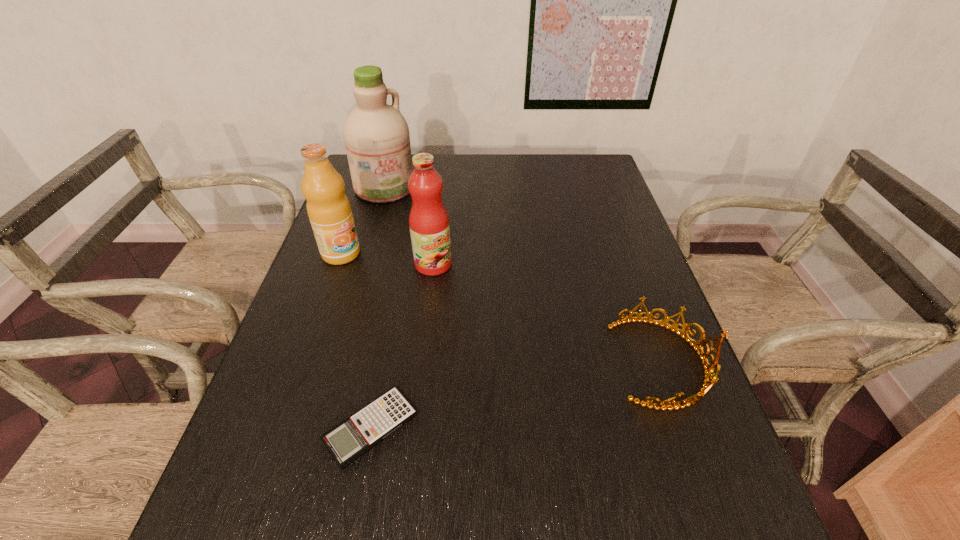
Where is `fruit juice that is at the left edge`? The height and width of the screenshot is (540, 960). fruit juice that is at the left edge is located at coordinates (329, 211).

This screenshot has width=960, height=540. In order to click on cleansing agent located at the left edge in this screenshot , I will do `click(376, 135)`.

At what (x,y) coordinates should I click in order to perform the action: click on object that is at the right edge. Please return your answer as a coordinate pair (x, y). This screenshot has width=960, height=540. Looking at the image, I should click on (708, 381).

The image size is (960, 540). In order to click on object that is at the far left corner in this screenshot , I will do `click(376, 135)`.

In order to click on object located at the near left corner in this screenshot , I will do `click(347, 441)`.

You are a GUI agent. You are given a task and a screenshot of the screen. Output one action in this format:
    pyautogui.click(x=<x>, y=<y>)
    Task: Click on the vacant space at the far edge
    The width and height of the screenshot is (960, 540).
    Given the screenshot: What is the action you would take?
    pyautogui.click(x=480, y=180)

In the image, there is a desktop. At what (x,y) coordinates should I click in order to perform the action: click on vacant space at the near edge. Please return your answer as a coordinate pair (x, y). Looking at the image, I should click on pos(455,462).

The height and width of the screenshot is (540, 960). What are the coordinates of `free space at the left edge of the desktop` in the screenshot? It's located at (356, 278).

Identify the location of vacant space at the right edge of the desktop. (599, 211).

The image size is (960, 540). In the image, there is a desktop. In order to click on free space at the near left corner in this screenshot , I will do `click(254, 447)`.